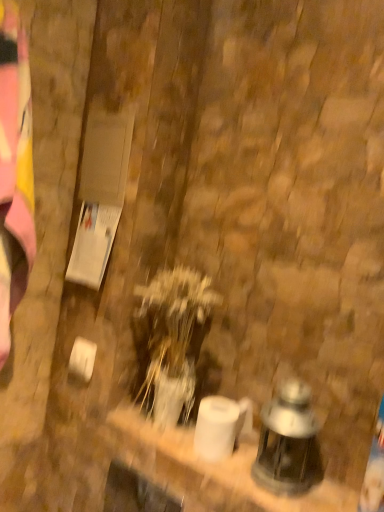
Question: Can you confirm if matte glass lantern at lower right is wider than translucent glass vase at center?

Choices:
 (A) no
 (B) yes

Answer: (A)

Question: Considering the relative sizes of matte glass lantern at lower right and translucent glass vase at center in the image provided, is matte glass lantern at lower right shorter than translucent glass vase at center?

Choices:
 (A) yes
 (B) no

Answer: (A)

Question: Is translucent glass vase at center inside matte glass lantern at lower right?

Choices:
 (A) no
 (B) yes

Answer: (A)

Question: From a real-world perspective, is matte glass lantern at lower right physically below translucent glass vase at center?

Choices:
 (A) yes
 (B) no

Answer: (A)

Question: Is matte glass lantern at lower right behind translucent glass vase at center?

Choices:
 (A) no
 (B) yes

Answer: (A)

Question: Does matte glass lantern at lower right have a greater height compared to translucent glass vase at center?

Choices:
 (A) no
 (B) yes

Answer: (A)

Question: Considering the relative sizes of translucent glass vase at center and matte glass lantern at lower right in the image provided, is translucent glass vase at center taller than matte glass lantern at lower right?

Choices:
 (A) no
 (B) yes

Answer: (B)

Question: From a real-world perspective, is translucent glass vase at center under matte glass lantern at lower right?

Choices:
 (A) yes
 (B) no

Answer: (B)

Question: Is translucent glass vase at center to the right of matte glass lantern at lower right from the viewer's perspective?

Choices:
 (A) no
 (B) yes

Answer: (A)

Question: Is translucent glass vase at center turned away from matte glass lantern at lower right?

Choices:
 (A) no
 (B) yes

Answer: (A)

Question: Does translucent glass vase at center have a larger size compared to matte glass lantern at lower right?

Choices:
 (A) no
 (B) yes

Answer: (B)

Question: Is translucent glass vase at center positioned beyond the bounds of matte glass lantern at lower right?

Choices:
 (A) yes
 (B) no

Answer: (A)

Question: Looking at their shapes, would you say matte glass lantern at lower right is wider or thinner than translucent glass vase at center?

Choices:
 (A) thin
 (B) wide

Answer: (A)